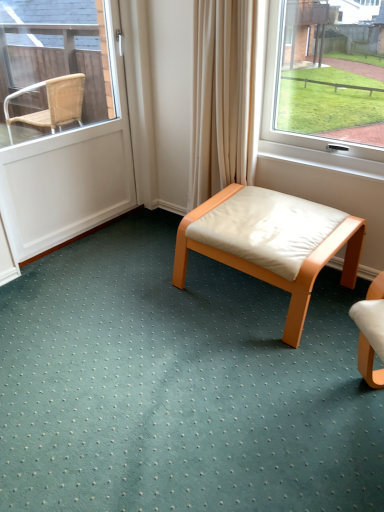
What is the approximate width of light brown wood stool at center?

light brown wood stool at center is 21.98 inches in width.

Measure the distance between light brown wood stool at center and camera.

1.56 meters.

The width and height of the screenshot is (384, 512). Find the location of `light brown wood stool at center`. light brown wood stool at center is located at coordinates (275, 249).

The height and width of the screenshot is (512, 384). What do you see at coordinates (275, 249) in the screenshot? I see `light brown wood stool at center` at bounding box center [275, 249].

In order to face light brown wood stool at center, should I rotate leftwards or rightwards?

Turn right by 9.475 degrees to look at light brown wood stool at center.

Find the location of a particular element. white matte door at left is located at coordinates (69, 175).

What do you see at coordinates (69, 175) in the screenshot? This screenshot has height=512, width=384. I see `white matte door at left` at bounding box center [69, 175].

Locate an element on the screen. The height and width of the screenshot is (512, 384). light brown wood stool at center is located at coordinates (275, 249).

Based on their positions, is light brown wood stool at center located to the left or right of white matte door at left?

Based on their positions, light brown wood stool at center is located to the right of white matte door at left.

Which is in front, light brown wood stool at center or white matte door at left?

light brown wood stool at center.

Between point (327, 238) and point (62, 226), which one is positioned behind?

Positioned behind is point (62, 226).

From the image's perspective, relative to white matte door at left, is light brown wood stool at center above or below?

light brown wood stool at center is situated lower than white matte door at left in the image.

From a real-world perspective, who is located higher, light brown wood stool at center or white matte door at left?

In real-world perspective, white matte door at left is above.

Considering the sizes of light brown wood stool at center and white matte door at left in the image, is light brown wood stool at center wider or thinner than white matte door at left?

Considering their sizes, light brown wood stool at center looks broader than white matte door at left.

Is light brown wood stool at center shorter than white matte door at left?

Yes, light brown wood stool at center is shorter than white matte door at left.

Is light brown wood stool at center bigger or smaller than white matte door at left?

Considering their sizes, light brown wood stool at center takes up more space than white matte door at left.

Do you think light brown wood stool at center is within white matte door at left, or outside of it?

The correct answer is: outside.

Is light brown wood stool at center positioned far away from white matte door at left?

Yes, light brown wood stool at center is far from white matte door at left.

Is light brown wood stool at center oriented towards white matte door at left?

No, light brown wood stool at center is not aimed at white matte door at left.

How different are the orientations of light brown wood stool at center and white matte door at left in degrees?

light brown wood stool at center and white matte door at left are facing 92.5 degrees away from each other.

Locate an element on the screen. The image size is (384, 512). table beneath the white matte door at left (from a real-world perspective) is located at coordinates (275, 249).

Would you say white matte door at left is to the left or to the right of light brown wood stool at center in the picture?

white matte door at left is to the left of light brown wood stool at center.

Which object is closer to the camera taking this photo, white matte door at left or light brown wood stool at center?

light brown wood stool at center is closer to the camera.

Considering the positions of points (30, 26) and (257, 225), is point (30, 26) closer to camera compared to point (257, 225)?

No, it is not.

From the image's perspective, which one is positioned higher, white matte door at left or light brown wood stool at center?

From the image's view, white matte door at left is above.

Based on the photo, from a real-world perspective, is white matte door at left physically below light brown wood stool at center?

No, from a real-world perspective, white matte door at left is not beneath light brown wood stool at center.

Considering the relative sizes of white matte door at left and light brown wood stool at center in the image provided, is white matte door at left wider than light brown wood stool at center?

No, white matte door at left is not wider than light brown wood stool at center.

Considering the relative sizes of white matte door at left and light brown wood stool at center in the image provided, is white matte door at left shorter than light brown wood stool at center?

In fact, white matte door at left may be taller than light brown wood stool at center.

Between white matte door at left and light brown wood stool at center, which one has larger size?

light brown wood stool at center.

Would you say white matte door at left contains light brown wood stool at center?

Actually, light brown wood stool at center is outside white matte door at left.

Are white matte door at left and light brown wood stool at center located far from each other?

That's right, there is a large distance between white matte door at left and light brown wood stool at center.

Looking at this image, is white matte door at left looking in the opposite direction of light brown wood stool at center?

No, white matte door at left is not facing away from light brown wood stool at center.

Can you tell me how much white matte door at left and light brown wood stool at center differ in facing direction?

The angle between the facing direction of white matte door at left and the facing direction of light brown wood stool at center is 92.5 degrees.

Locate an element on the screen. This screenshot has height=512, width=384. door on the left of light brown wood stool at center is located at coordinates (69, 175).

Where is `table that appears below the white matte door at left (from a real-world perspective)`? The width and height of the screenshot is (384, 512). table that appears below the white matte door at left (from a real-world perspective) is located at coordinates (275, 249).

The image size is (384, 512). I want to click on door behind the light brown wood stool at center, so click(69, 175).